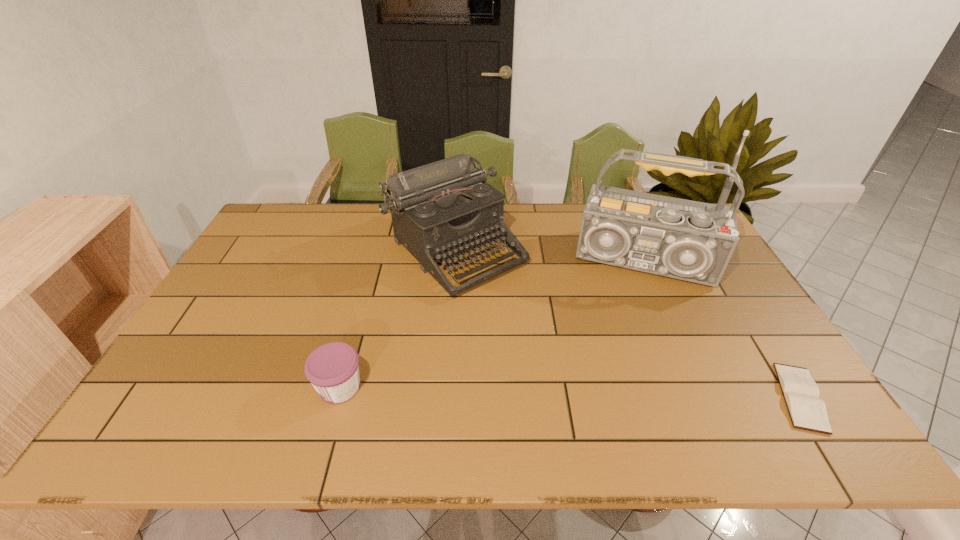
The image size is (960, 540). In order to click on the second shortest object in this screenshot , I will do `click(333, 369)`.

Find the location of a particular element. the shortest object is located at coordinates (801, 393).

Locate an element on the screen. Image resolution: width=960 pixels, height=540 pixels. the second tallest object is located at coordinates (440, 209).

Find the location of a particular element. This screenshot has width=960, height=540. the tallest object is located at coordinates (694, 241).

I want to click on free space located 0.290m on the front label of the second shortest object, so click(x=193, y=387).

At what (x,y) coordinates should I click in order to perform the action: click on free location located 0.160m on the front label of the second shortest object. Please return your answer as a coordinate pair (x, y). Looking at the image, I should click on (247, 387).

The height and width of the screenshot is (540, 960). In order to click on vacant space situated on the front label of the second shortest object in this screenshot , I will do `click(280, 387)`.

At what (x,y) coordinates should I click in order to perform the action: click on vacant region located 0.200m on the left of the shortest object. Please return your answer as a coordinate pair (x, y). The width and height of the screenshot is (960, 540). Looking at the image, I should click on (689, 397).

The width and height of the screenshot is (960, 540). I want to click on blank space located on the typing side of the second tallest object, so click(538, 328).

This screenshot has height=540, width=960. In order to click on free space located 0.250m on the typing side of the second tallest object in this screenshot , I will do `click(555, 345)`.